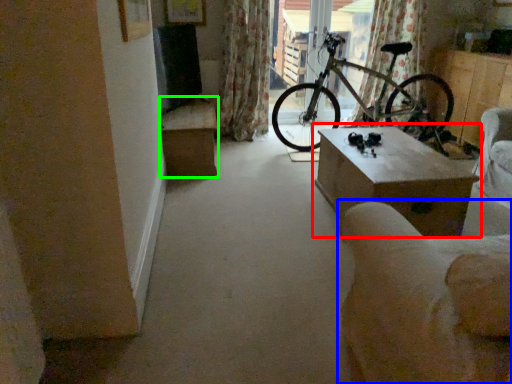
Question: Based on their relative distances, which object is farther from table (highlighted by a red box)? Choose from armchair (highlighted by a blue box) and table (highlighted by a green box).

Choices:
 (A) armchair
 (B) table

Answer: (B)